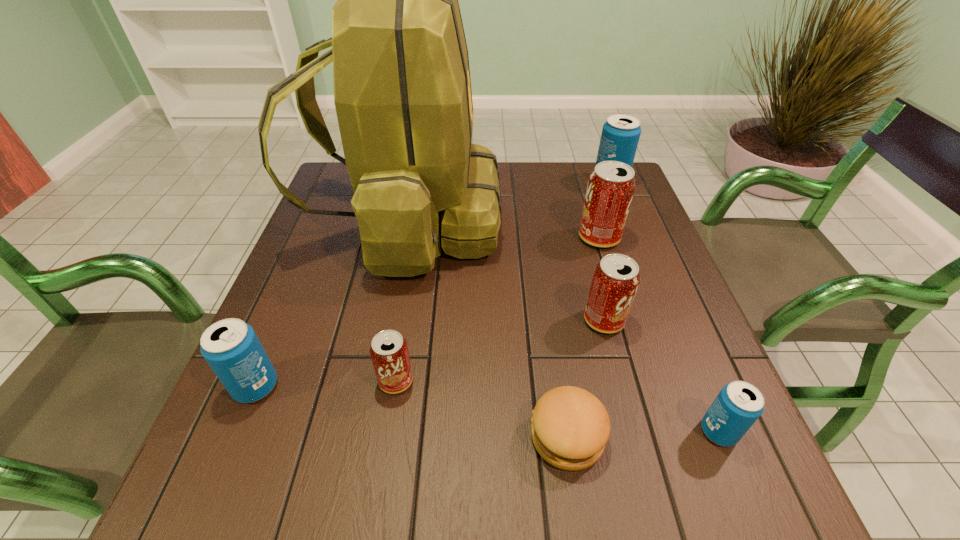
You are a GUI agent. You are given a task and a screenshot of the screen. Output one action in this format:
    pyautogui.click(x=<x>, y=<y>)
    Task: Click on the leftmost red soda can
    The width and height of the screenshot is (960, 540).
    Given the screenshot: What is the action you would take?
    click(x=389, y=352)

This screenshot has width=960, height=540. What are the coordinates of `the smallest blue soda can` in the screenshot? It's located at (738, 405).

You are a GUI agent. You are given a task and a screenshot of the screen. Output one action in this format:
    pyautogui.click(x=<x>, y=<y>)
    Task: Click on the nearest soda can
    The height and width of the screenshot is (540, 960).
    Given the screenshot: What is the action you would take?
    pyautogui.click(x=738, y=405)

Where is `the fourth object from left to right`? the fourth object from left to right is located at coordinates (570, 427).

Identify the location of hamburger. This screenshot has width=960, height=540. (570, 427).

I want to click on free space located 0.170m on the front-facing side of the backpack, so click(x=564, y=221).

The image size is (960, 540). Identify the location of free spot located on the left of the biggest blue soda can. (499, 181).

At what (x,y) coordinates should I click in order to perform the action: click on vacant space located 0.080m on the left of the farthest red soda can. Please return your answer as a coordinate pair (x, y). Image resolution: width=960 pixels, height=540 pixels. Looking at the image, I should click on click(547, 238).

This screenshot has width=960, height=540. Find the location of `vacant space located 0.070m on the left of the second farthest red soda can`. vacant space located 0.070m on the left of the second farthest red soda can is located at coordinates (550, 320).

You are a GUI agent. You are given a task and a screenshot of the screen. Output one action in this format:
    pyautogui.click(x=<x>, y=<y>)
    Task: Click on the free space located 0.180m on the front of the second farthest blue soda can
    The height and width of the screenshot is (540, 960).
    Given the screenshot: What is the action you would take?
    pyautogui.click(x=202, y=515)